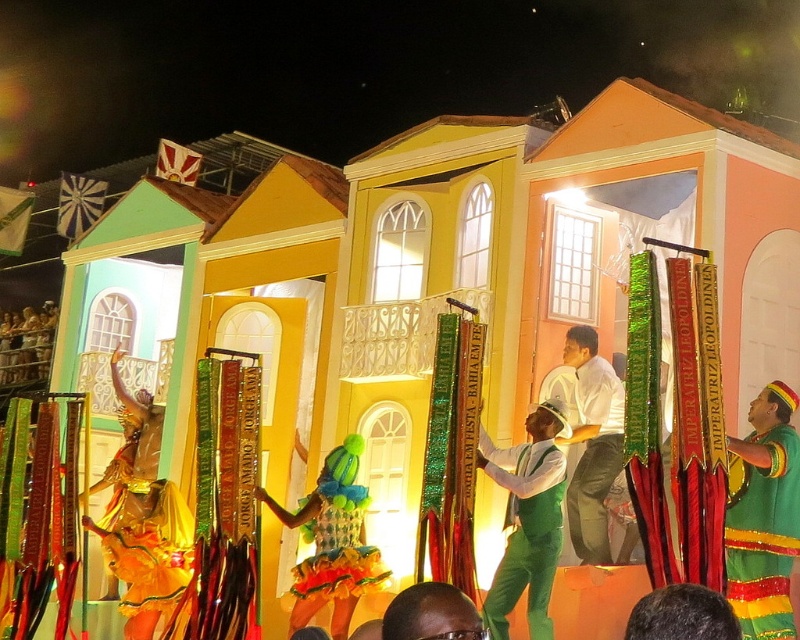
Question: Does green fabric at center appear on the right side of shiny metallic costume at center?

Choices:
 (A) yes
 (B) no

Answer: (A)

Question: Which point is farther to the camera?

Choices:
 (A) (501, 467)
 (B) (609, 392)

Answer: (B)

Question: In this image, where is shiny metallic costume at center located relative to white glossy shirt at center?

Choices:
 (A) right
 (B) left

Answer: (B)

Question: Which point appears closest to the camera in this image?

Choices:
 (A) (576, 328)
 (B) (294, 596)

Answer: (B)

Question: Which object is positioned closest to the white glossy shirt at center?

Choices:
 (A) green fabric at center
 (B) shiny metallic costume at center

Answer: (A)

Question: Where is green fabric at center located in relation to shiny metallic costume at center in the image?

Choices:
 (A) above
 (B) below

Answer: (A)